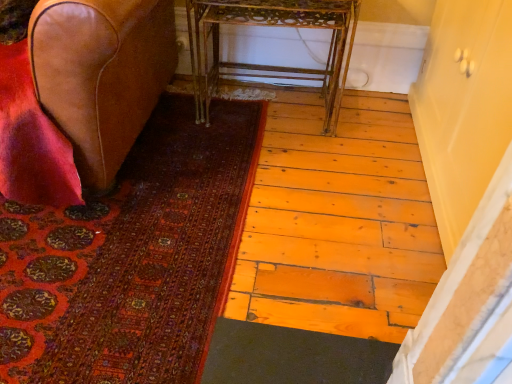
What do you see at coordinates (132, 258) in the screenshot? I see `carpeted mat at lower left` at bounding box center [132, 258].

This screenshot has height=384, width=512. What do you see at coordinates (463, 107) in the screenshot? I see `matte cream cabinet at right` at bounding box center [463, 107].

Locate an element on the screen. Image resolution: width=512 pixels, height=384 pixels. carpeted mat at lower left is located at coordinates (132, 258).

Considering the relative sizes of matte cream cabinet at right and carpeted mat at lower left in the image provided, is matte cream cabinet at right smaller than carpeted mat at lower left?

Incorrect, matte cream cabinet at right is not smaller in size than carpeted mat at lower left.

Is carpeted mat at lower left at the back of matte cream cabinet at right?

No.

Is matte cream cabinet at right inside or outside of carpeted mat at lower left?

matte cream cabinet at right is not inside carpeted mat at lower left, it's outside.

Can you confirm if metallic gold table at center is shorter than matte cream cabinet at right?

Yes.

From a real-world perspective, is metallic gold table at center physically located above or below matte cream cabinet at right?

metallic gold table at center is situated lower than matte cream cabinet at right in the real world.

Do you think metallic gold table at center is within matte cream cabinet at right, or outside of it?

metallic gold table at center is spatially situated outside matte cream cabinet at right.

From the picture: From a real-world perspective, does carpeted mat at lower left stand above matte cream cabinet at right?

Actually, carpeted mat at lower left is physically below matte cream cabinet at right in the real world.

From the image's perspective, between carpeted mat at lower left and matte cream cabinet at right, which one is located above?

matte cream cabinet at right, from the image's perspective.

Is carpeted mat at lower left positioned with its back to matte cream cabinet at right?

No, carpeted mat at lower left is not facing the opposite direction of matte cream cabinet at right.

Who is shorter, carpeted mat at lower left or matte cream cabinet at right?

carpeted mat at lower left is shorter.

Between leather at left and metallic gold table at center, which one has smaller size?

Smaller between the two is metallic gold table at center.

Who is more distant, leather at left or metallic gold table at center?

metallic gold table at center is behind.

Which point is more distant from viewer, (88, 67) or (298, 26)?

The point (298, 26) is more distant.

In the scene shown: Could you tell me if leather at left is turned towards metallic gold table at center?

No, leather at left does not turn towards metallic gold table at center.

In terms of width, does leather at left look wider or thinner when compared to carpeted mat at lower left?

In the image, leather at left appears to be wider than carpeted mat at lower left.

Considering the points (153, 82) and (21, 355), which point is in front, point (153, 82) or point (21, 355)?

The point (21, 355) is in front.

Between leather at left and carpeted mat at lower left, which one has less height?

carpeted mat at lower left.

From the image's perspective, which one is positioned lower, matte cream cabinet at right or leather at left?

matte cream cabinet at right is shown below in the image.

From a real-world perspective, between matte cream cabinet at right and leather at left, who is vertically lower?

matte cream cabinet at right is physically lower.

Is point (452, 1) closer to viewer compared to point (49, 10)?

No.

Does matte cream cabinet at right touch leather at left?

matte cream cabinet at right is not next to leather at left, and they're not touching.

Does point (249, 4) lie behind point (106, 286)?

That is True.

Does metallic gold table at center have a lesser height compared to carpeted mat at lower left?

No.

Is metallic gold table at center with carpeted mat at lower left?

No, metallic gold table at center is not touching carpeted mat at lower left.

I want to click on screen door lying above the carpeted mat at lower left (from the image's perspective), so click(463, 107).

Identify the location of table directly beneath the matte cream cabinet at right (from a real-world perspective). This screenshot has height=384, width=512. (272, 26).

Based on their spatial positions, is leather at left or carpeted mat at lower left further from metallic gold table at center?

carpeted mat at lower left is further to metallic gold table at center.

Which object lies nearer to the anchor point carpeted mat at lower left, matte cream cabinet at right or metallic gold table at center?

metallic gold table at center lies closer to carpeted mat at lower left than the other object.

Considering their positions, is metallic gold table at center positioned further to leather at left than carpeted mat at lower left?

metallic gold table at center lies further to leather at left than the other object.

From the image, which object appears to be farther from carpeted mat at lower left, metallic gold table at center or matte cream cabinet at right?

Based on the image, matte cream cabinet at right appears to be further to carpeted mat at lower left.

Based on their spatial positions, is carpeted mat at lower left or matte cream cabinet at right closer to leather at left?

carpeted mat at lower left.

From the image, which object appears to be nearer to matte cream cabinet at right, carpeted mat at lower left or metallic gold table at center?

The object closer to matte cream cabinet at right is metallic gold table at center.

From the image, which object appears to be nearer to metallic gold table at center, leather at left or matte cream cabinet at right?

The object closer to metallic gold table at center is leather at left.

Which object lies further to the anchor point carpeted mat at lower left, leather at left or matte cream cabinet at right?

The object further to carpeted mat at lower left is matte cream cabinet at right.

In order to click on table located between carpeted mat at lower left and matte cream cabinet at right in the left-right direction in this screenshot , I will do `click(272, 26)`.

The image size is (512, 384). Find the location of `mat between leather at left and metallic gold table at center in the horizontal direction`. mat between leather at left and metallic gold table at center in the horizontal direction is located at coordinates (132, 258).

This screenshot has width=512, height=384. I want to click on table between leather at left and matte cream cabinet at right, so click(272, 26).

At what (x,y) coordinates should I click in order to perform the action: click on mat situated between leather at left and matte cream cabinet at right from left to right. Please return your answer as a coordinate pair (x, y). This screenshot has width=512, height=384. Looking at the image, I should click on (132, 258).